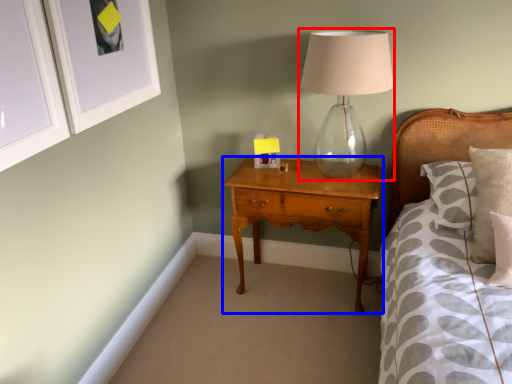
Question: Which of the following is the farthest to the observer, table lamp (highlighted by a red box) or nightstand (highlighted by a blue box)?

Choices:
 (A) table lamp
 (B) nightstand

Answer: (B)